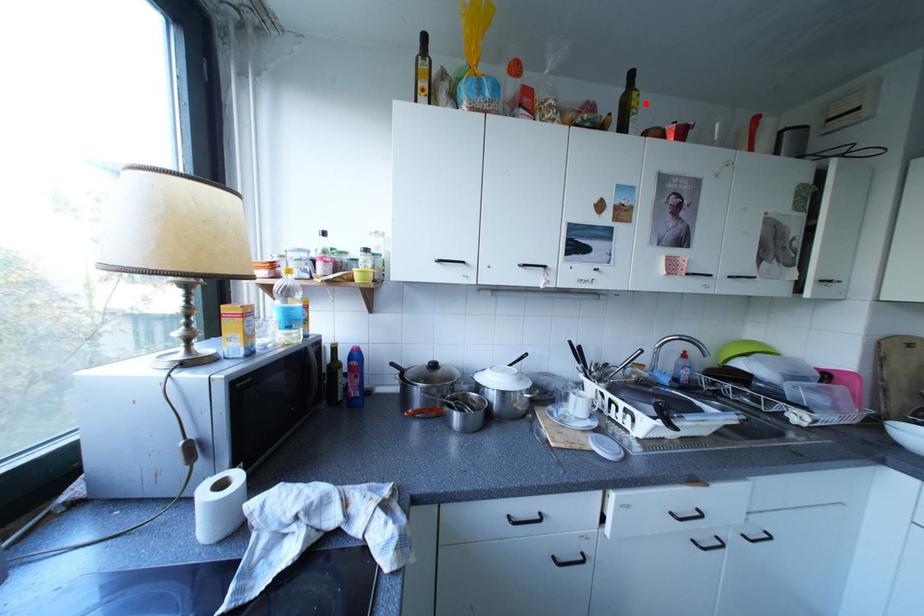
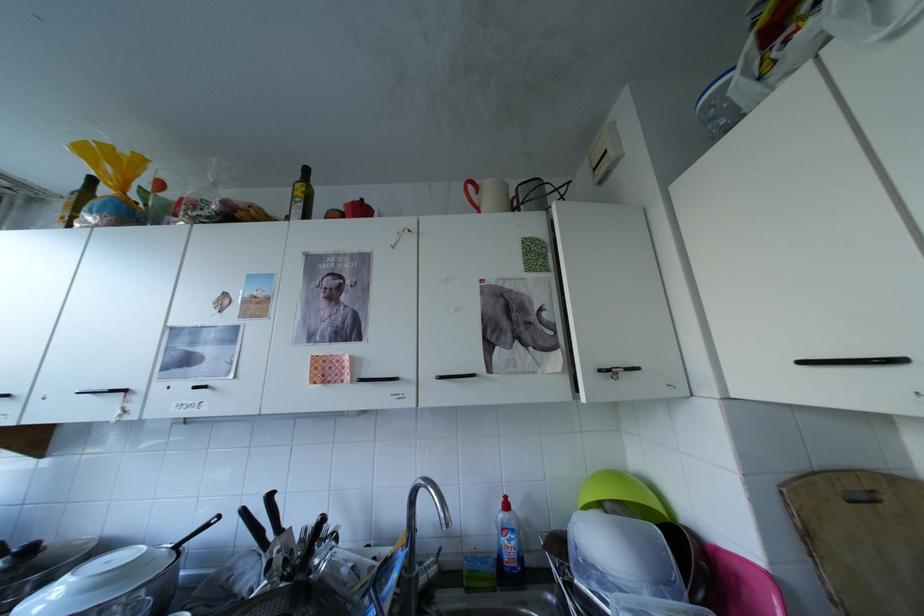
Find the pixel in the second image that matches the highlighted location in the first image.

(309, 193)